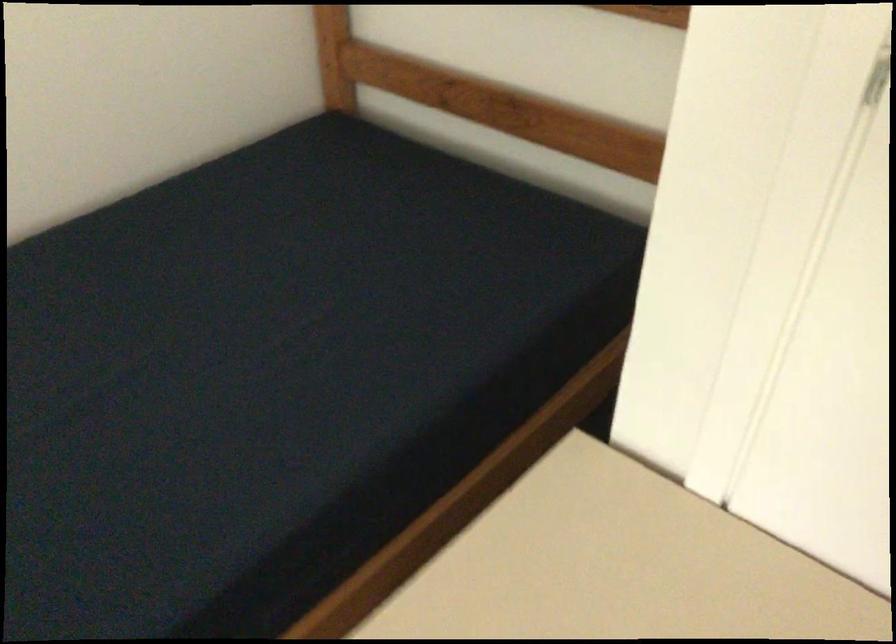
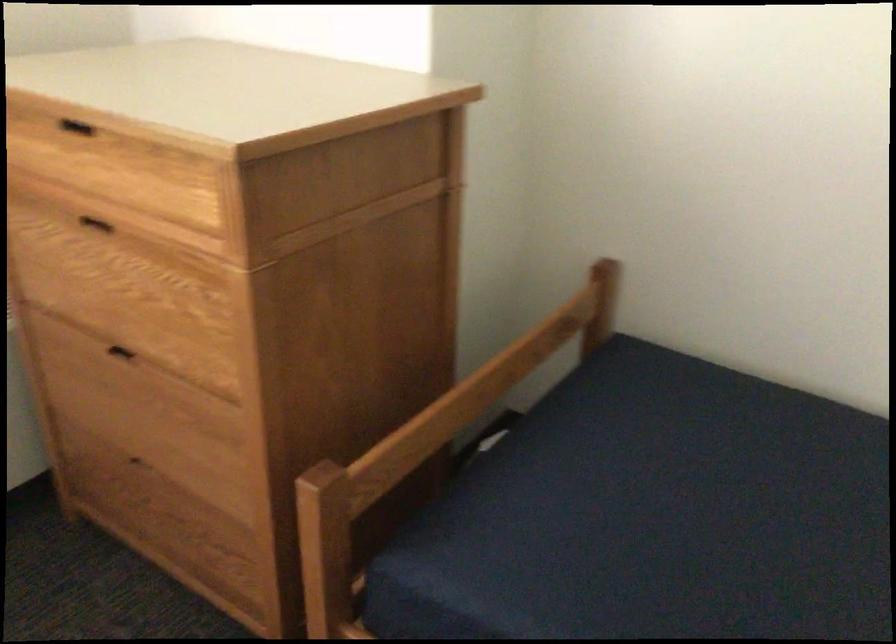
First-person continuous shooting, in which direction is the camera rotating?

The camera rotated toward left-down.